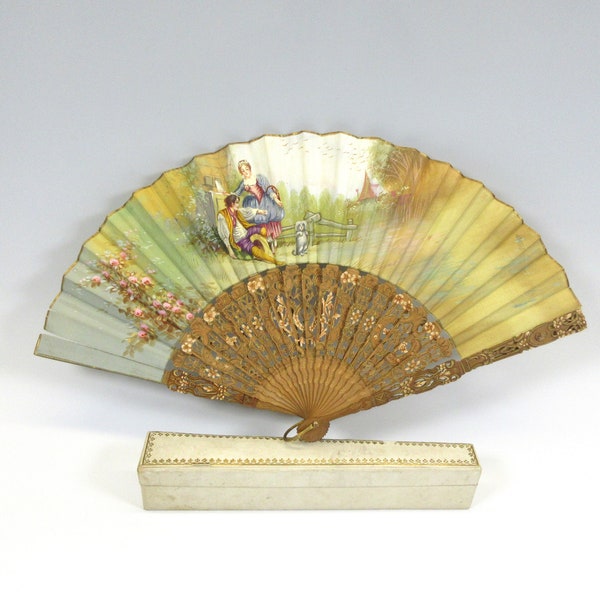
The image size is (600, 600). I want to click on handle, so click(x=293, y=427), click(x=303, y=432), click(x=323, y=426), click(x=315, y=435).